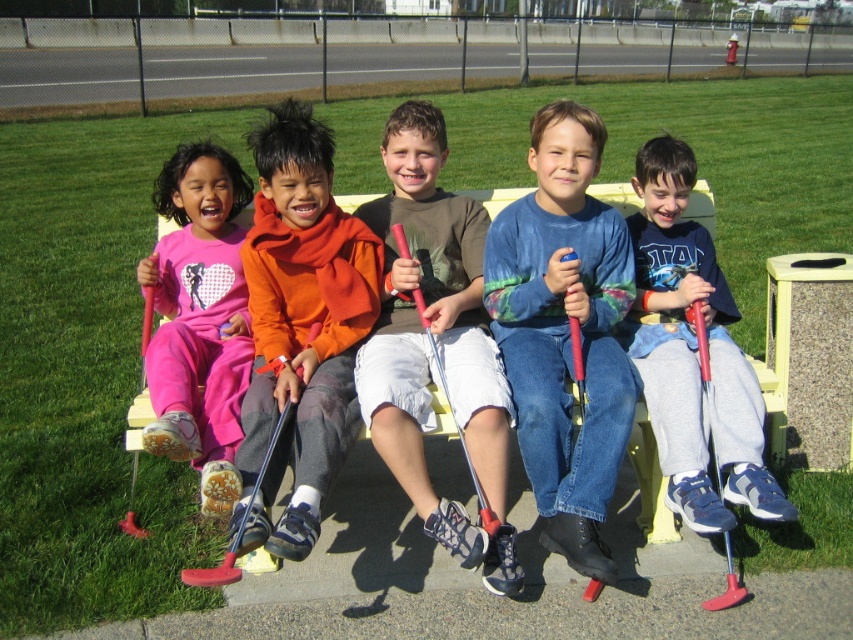
Between point (381, 234) and point (216, 288), which one is positioned behind?

Point (216, 288)

Image resolution: width=853 pixels, height=640 pixels. I want to click on matte orange hoodie at center, so click(x=437, y=342).

Is point (467, 419) in front of point (674, 432)?

Yes, it is.

Is matte orange hoodie at center shorter than blue cotton shirt at center?

Incorrect, matte orange hoodie at center's height does not fall short of blue cotton shirt at center's.

This screenshot has width=853, height=640. What do you see at coordinates (437, 342) in the screenshot?
I see `matte orange hoodie at center` at bounding box center [437, 342].

The image size is (853, 640). I want to click on matte orange hoodie at center, so click(437, 342).

Does blue cotton shirt at center appear on the left side of yellow plastic bench at center?

No, blue cotton shirt at center is not to the left of yellow plastic bench at center.

Who is lower down, blue cotton shirt at center or yellow plastic bench at center?

yellow plastic bench at center

Locate an element on the screen. The height and width of the screenshot is (640, 853). blue cotton shirt at center is located at coordinates (692, 353).